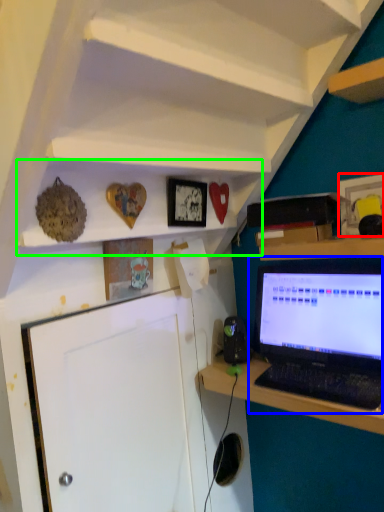
Question: Which object is positioned farthest from picture frame (highlighted by a red box)? Select from laptop (highlighted by a blue box) and shelf (highlighted by a green box).

Choices:
 (A) laptop
 (B) shelf

Answer: (B)